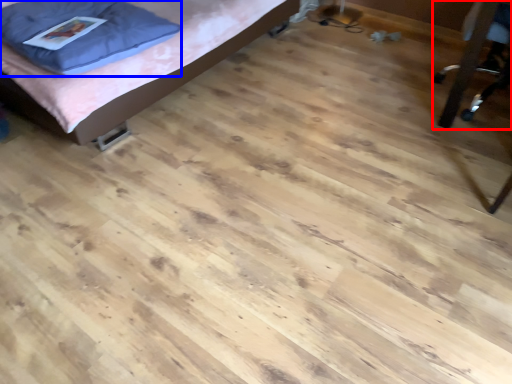
Question: Which point is closer to the camera, furniture (highlighted by a red box) or pillow (highlighted by a blue box)?

Choices:
 (A) furniture
 (B) pillow

Answer: (A)